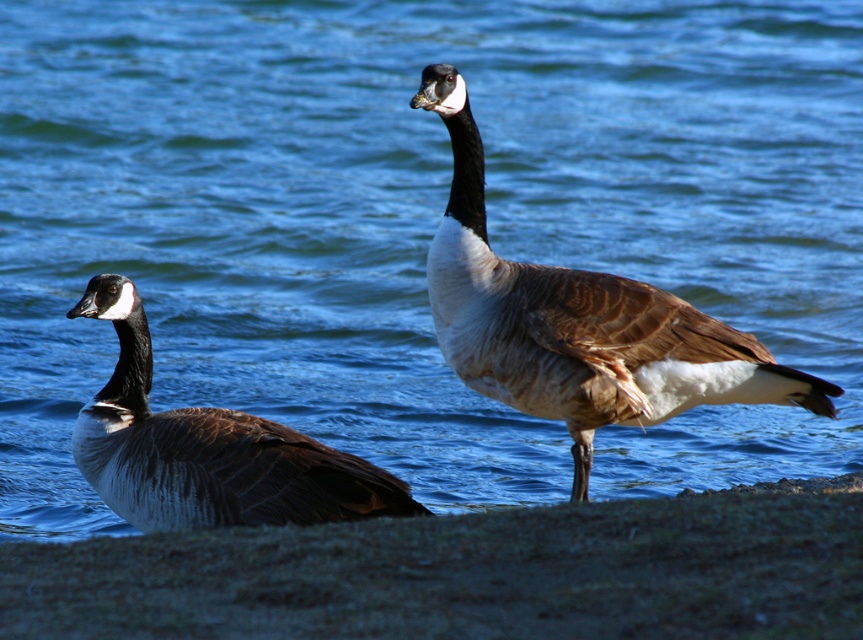
Does sandy shore at lower left have a larger size compared to brown feathered duck at left?

Actually, sandy shore at lower left might be smaller than brown feathered duck at left.

Is point (351, 573) farther from camera compared to point (112, 310)?

No, it is not.

Is point (194, 586) more distant than point (131, 429)?

No.

Where is `sandy shore at lower left`? The height and width of the screenshot is (640, 863). sandy shore at lower left is located at coordinates (471, 573).

Which is below, sandy shore at lower left or brown feathered goose at center?

sandy shore at lower left is lower down.

Measure the distance between sandy shore at lower left and camera.

sandy shore at lower left is 2.31 meters from camera.

Which is behind, point (669, 584) or point (468, 326)?

The point (468, 326) is more distant.

At what (x,y) coordinates should I click in order to perform the action: click on sandy shore at lower left. Please return your answer as a coordinate pair (x, y). Looking at the image, I should click on (471, 573).

Consider the image. Does brown feathered goose at center have a lesser height compared to brown feathered duck at left?

Incorrect, brown feathered goose at center's height does not fall short of brown feathered duck at left's.

Locate an element on the screen. brown feathered goose at center is located at coordinates tap(577, 323).

You are a GUI agent. You are given a task and a screenshot of the screen. Output one action in this format:
    pyautogui.click(x=<x>, y=<y>)
    Task: Click on the brown feathered goose at center
    The width and height of the screenshot is (863, 640).
    Given the screenshot: What is the action you would take?
    pyautogui.click(x=577, y=323)